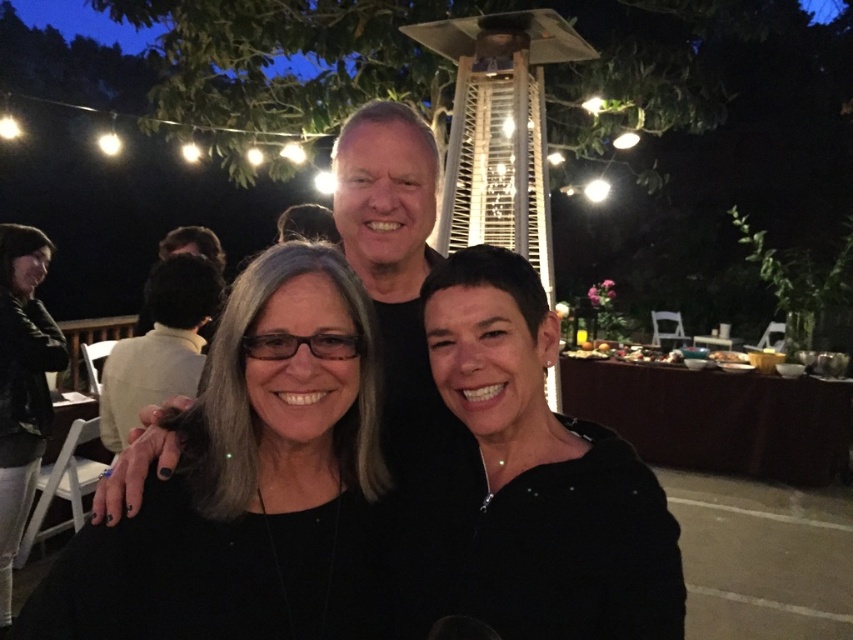
Does point (426, 426) come closer to viewer compared to point (0, 237)?

Yes, point (426, 426) is closer to viewer.

Is matte black shirt at center closer to camera compared to black leather jacket at lower left?

That is True.

You are a GUI agent. You are given a task and a screenshot of the screen. Output one action in this format:
    pyautogui.click(x=<x>, y=<y>)
    Task: Click on the matte black shirt at center
    
    Given the screenshot: What is the action you would take?
    pyautogui.click(x=392, y=259)

Who is positioned more to the right, black matte/soft fabric at center or smooth brown hair at center?

black matte/soft fabric at center

Describe the element at coordinates (544, 472) in the screenshot. I see `black matte/soft fabric at center` at that location.

The image size is (853, 640). I want to click on black matte/soft fabric at center, so click(x=544, y=472).

Who is lower down, black matte glasses at center or matte black shirt at center?

black matte glasses at center

Who is more distant from viewer, (305, 404) or (397, 413)?

The point (397, 413) is more distant.

Describe the element at coordinates (250, 483) in the screenshot. The image size is (853, 640). I see `black matte glasses at center` at that location.

You are a GUI agent. You are given a task and a screenshot of the screen. Output one action in this format:
    pyautogui.click(x=<x>, y=<y>)
    Task: Click on the black matte glasses at center
    This screenshot has width=853, height=640.
    Given the screenshot: What is the action you would take?
    pyautogui.click(x=250, y=483)